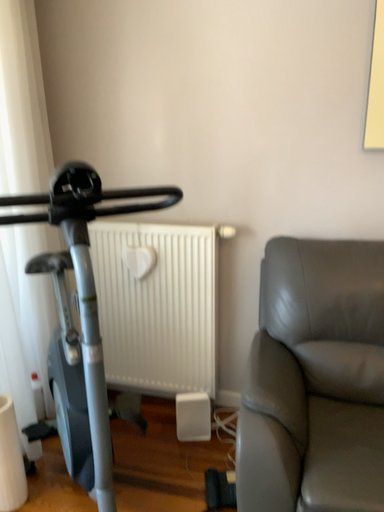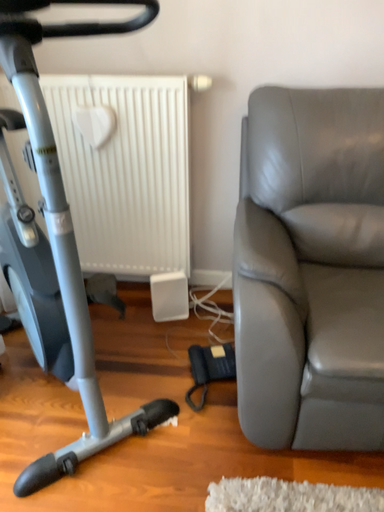
Question: How did the camera likely rotate when shooting the video?

Choices:
 (A) rotated upward
 (B) rotated downward

Answer: (B)